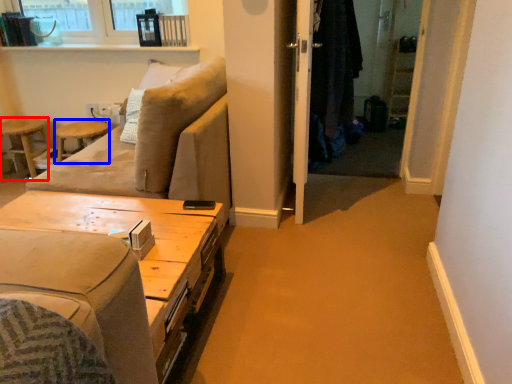
Question: Which of the following is the farthest to the observer, bar stool (highlighted by a red box) or bar stool (highlighted by a blue box)?

Choices:
 (A) bar stool
 (B) bar stool

Answer: (A)